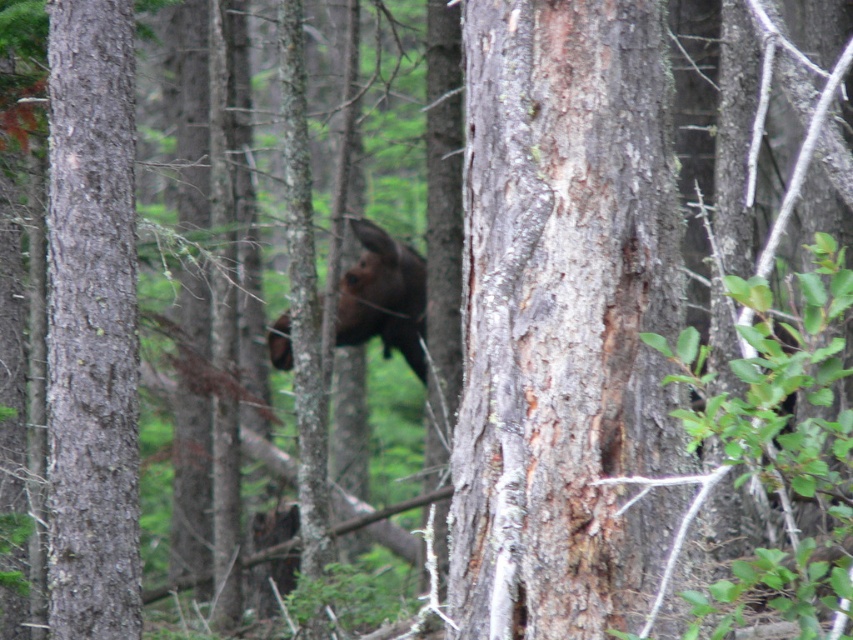
Question: Is gray rough bark tree trunk at center wider than brown furry moose at center?

Choices:
 (A) no
 (B) yes

Answer: (A)

Question: Which point is farther to the camera?

Choices:
 (A) gray rough bark tree trunk at center
 (B) brown furry moose at center
 (C) smooth brown tree trunk at left

Answer: (B)

Question: Does smooth brown tree trunk at left have a larger size compared to brown furry moose at center?

Choices:
 (A) no
 (B) yes

Answer: (A)

Question: Is gray rough bark tree trunk at center to the right of smooth brown tree trunk at left from the viewer's perspective?

Choices:
 (A) yes
 (B) no

Answer: (A)

Question: Among these points, which one is nearest to the camera?

Choices:
 (A) (508, 612)
 (B) (97, 340)
 (C) (387, 356)

Answer: (A)

Question: Based on their relative distances, which object is nearer to the gray rough bark tree trunk at center?

Choices:
 (A) brown furry moose at center
 (B) smooth brown tree trunk at left

Answer: (B)